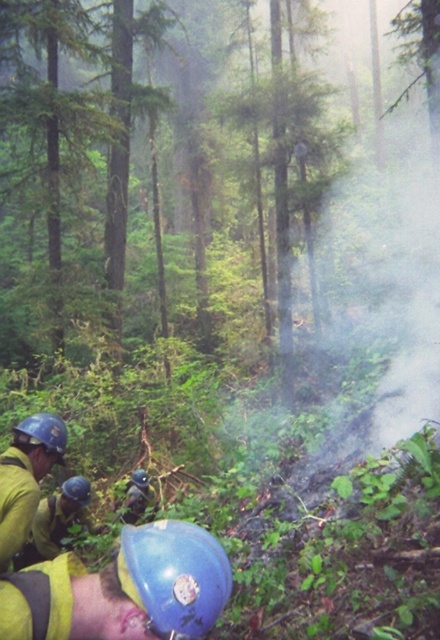
You are a drone operator tasked with capturing aerial footage of the firefighters in the dense forest. You need to adjust your drone to focus on both the point at coordinate point (7, 557) and point (55, 438). Which point should you adjust your drone to focus on first to ensure both points are in frame?

Point (7, 557) is closer to the camera than point (55, 438), so you should focus on point (7, 557) first to ensure both points are within the drone camera frame.

You are a firefighter in the forest and need to move from your current position to a safer area behind your team members. You see the matte blue helmet at lower left and the matte blue helmet at lower center. Which helmet should you move behind to ensure you are positioned further back?

You should move behind the matte blue helmet at lower center because the matte blue helmet at lower left is in front of it, making the latter a safer position further back.

You are a new firefighter arriving at the scene and need to choose protective gear. There are two helmets available in the gear room. Which one is larger in size between the blue hard hat at lower left and the matte blue helmet at lower center?

The blue hard hat at lower left is larger than the matte blue helmet at lower center, so you should choose the blue hard hat at lower left if you need a larger size.